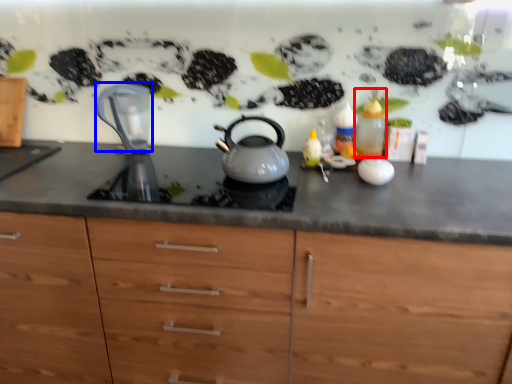
Question: Which object appears closest to the camera in this image, bottle (highlighted by a red box) or jug (highlighted by a blue box)?

Choices:
 (A) bottle
 (B) jug

Answer: (A)